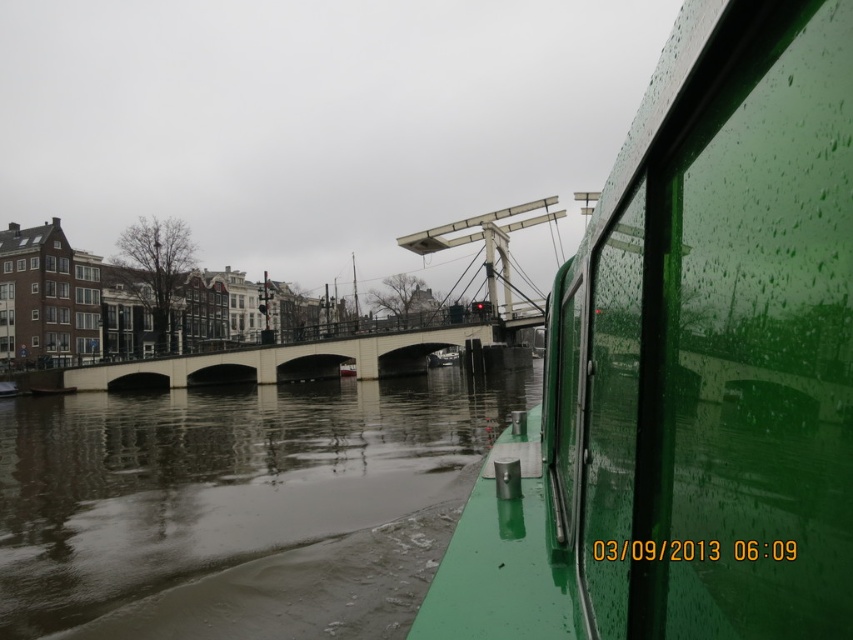
Question: Does smooth water at center appear on the right side of white concrete bridge at center?

Choices:
 (A) yes
 (B) no

Answer: (A)

Question: Is smooth water at center wider than white concrete bridge at center?

Choices:
 (A) no
 (B) yes

Answer: (A)

Question: Is the position of smooth water at center less distant than that of white concrete bridge at center?

Choices:
 (A) yes
 (B) no

Answer: (A)